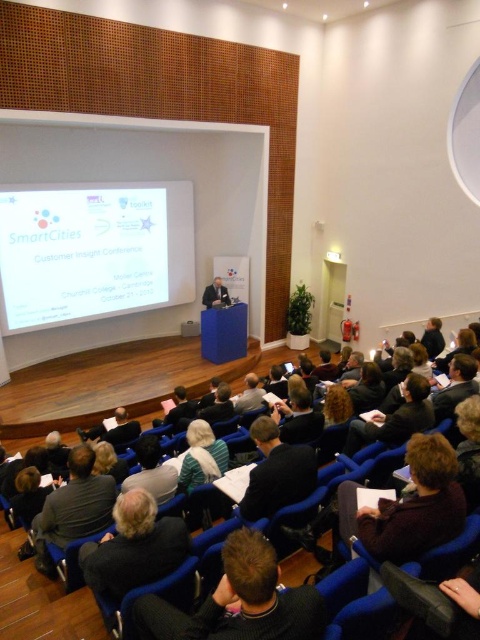
Looking at this image, you are an attendee at the SmartCities Customer Insight Conference. You notice two features in the front row of the stage area. One is the dark brown hair at lower center and the other is the dark gray sweater at lower left. Which of these two features is positioned higher up in the image?

The dark brown hair at lower center is located above the dark gray sweater at lower left, so it is positioned higher up in the image.